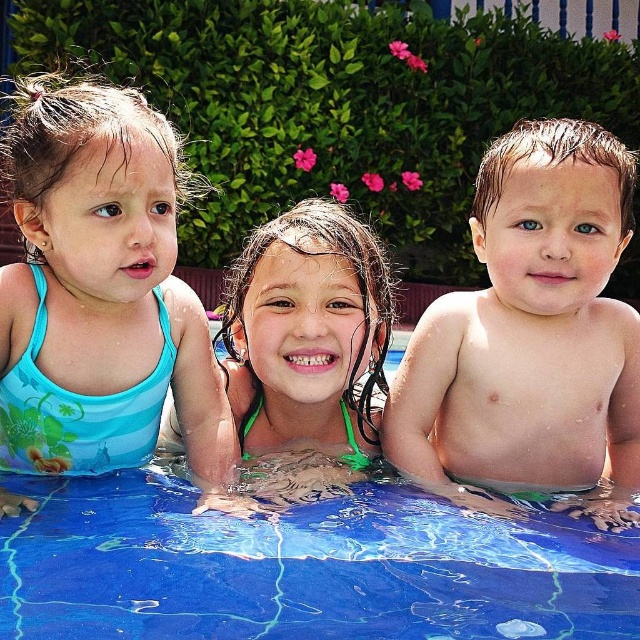
Is point (442, 580) positioned in front of point (179, 182)?

Yes.

Between point (376, 579) and point (44, 74), which one is positioned behind?

The point (44, 74) is behind.

This screenshot has width=640, height=640. Identify the location of blue glossy water at center. (301, 563).

Which is more to the left, blue glossy water at center or smooth skin baby at right?

Positioned to the left is blue glossy water at center.

Does point (244, 572) come closer to viewer compared to point (545, 312)?

That is True.

This screenshot has height=640, width=640. Find the location of `blue glossy water at center`. blue glossy water at center is located at coordinates (301, 563).

Is point (58, 529) less distant than point (310, 339)?

Yes, it is.

Can you confirm if blue glossy water at center is positioned below green fabric swimsuit at center?

Correct, blue glossy water at center is located below green fabric swimsuit at center.

Which is behind, point (192, 627) or point (365, 369)?

Point (365, 369)

Identify the location of blue glossy water at center. click(301, 563).